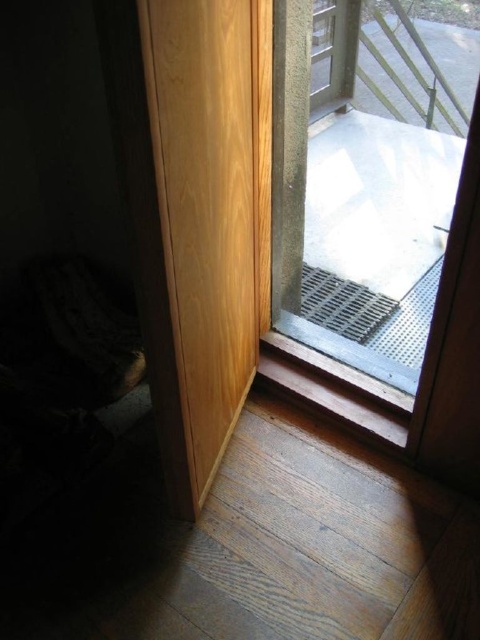
You are standing inside the room and want to exit through the door. Which door should you open first, the transparent glass door at upper right or the light wood door at left?

You should open the transparent glass door at upper right first because the light wood door at left is behind it.